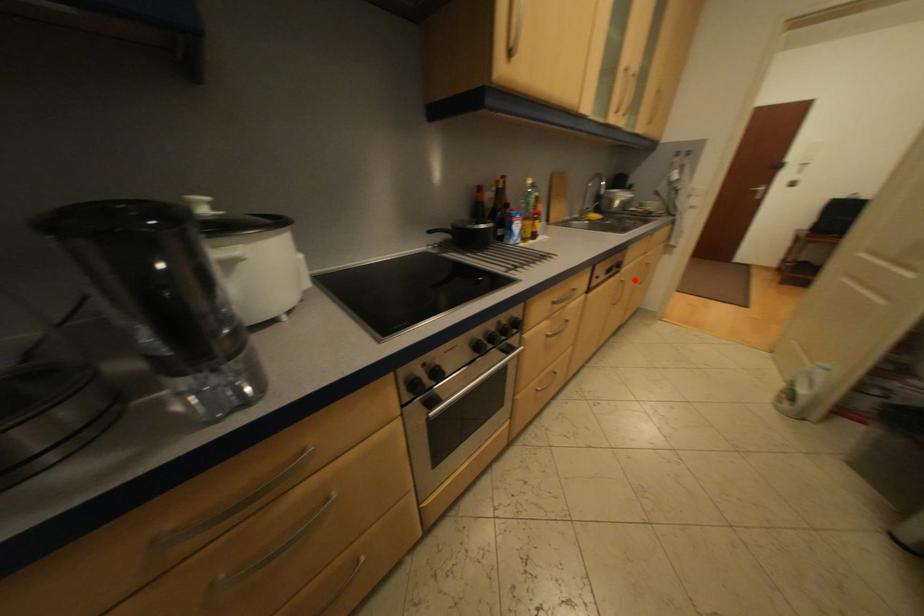
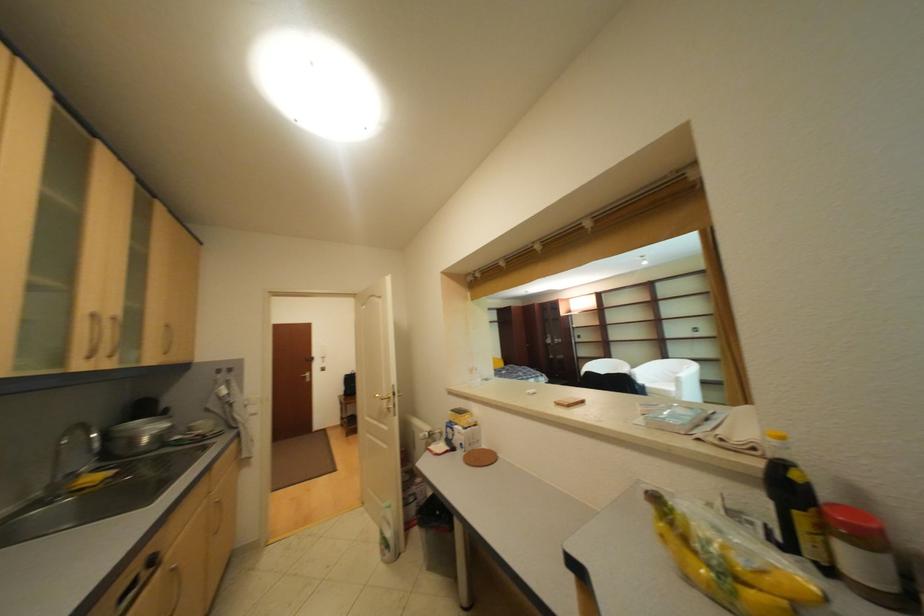
Where in the second image is the point corresponding to the highlighted location from the first image?

(186, 567)